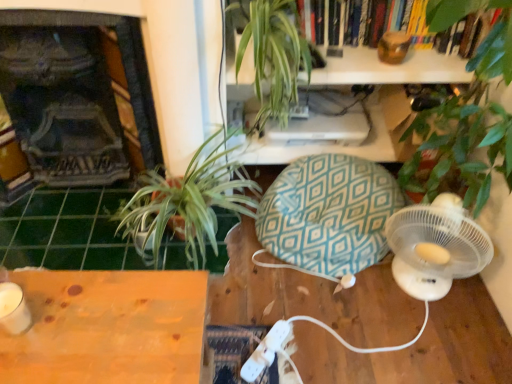
Question: Is green leafy plant at left bigger than green tile at lower left?

Choices:
 (A) no
 (B) yes

Answer: (B)

Question: Does green leafy plant at left have a lesser height compared to green tile at lower left?

Choices:
 (A) no
 (B) yes

Answer: (A)

Question: Is green leafy plant at left positioned behind green tile at lower left?

Choices:
 (A) no
 (B) yes

Answer: (A)

Question: From a real-world perspective, is green leafy plant at left located higher than green tile at lower left?

Choices:
 (A) no
 (B) yes

Answer: (B)

Question: Is green leafy plant at left at the right side of green tile at lower left?

Choices:
 (A) yes
 (B) no

Answer: (A)

Question: Considering the relative positions of green leafy plant at left and green tile at lower left in the image provided, is green leafy plant at left to the left of green tile at lower left from the viewer's perspective?

Choices:
 (A) yes
 (B) no

Answer: (B)

Question: From the image's perspective, is green leafy plant at upper center under wooden table at lower left?

Choices:
 (A) yes
 (B) no

Answer: (B)

Question: Considering the relative sizes of green leafy plant at upper center and wooden table at lower left in the image provided, is green leafy plant at upper center thinner than wooden table at lower left?

Choices:
 (A) no
 (B) yes

Answer: (B)

Question: Is green leafy plant at upper center bigger than wooden table at lower left?

Choices:
 (A) no
 (B) yes

Answer: (A)

Question: Does green leafy plant at upper center have a greater width compared to wooden table at lower left?

Choices:
 (A) yes
 (B) no

Answer: (B)

Question: From the image's perspective, does green leafy plant at upper center appear higher than wooden table at lower left?

Choices:
 (A) yes
 (B) no

Answer: (A)

Question: Is green leafy plant at upper center at the right side of wooden table at lower left?

Choices:
 (A) yes
 (B) no

Answer: (A)

Question: From the image's perspective, is wooden table at lower left located above green leafy plant at upper center?

Choices:
 (A) yes
 (B) no

Answer: (B)